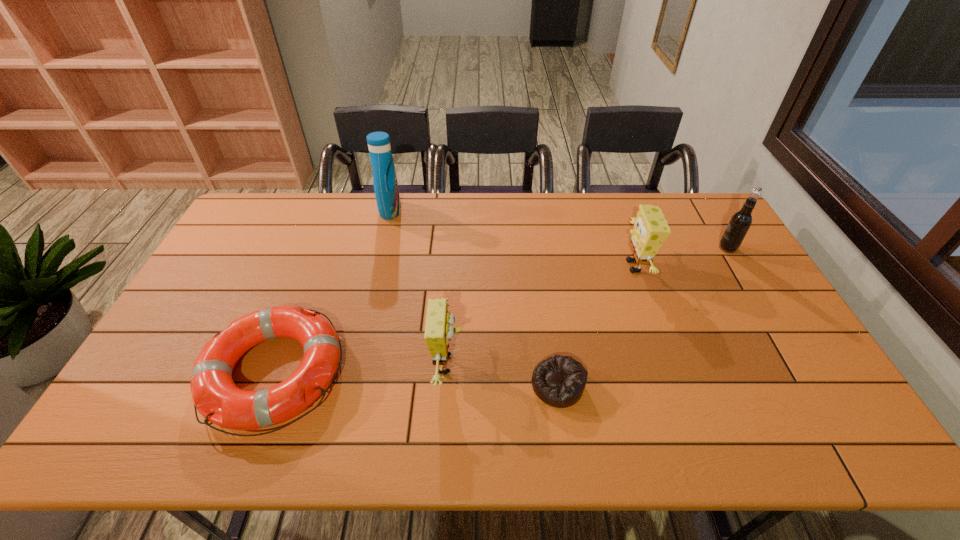
Where is `object at the far edge`? This screenshot has width=960, height=540. object at the far edge is located at coordinates (385, 183).

Where is `object that is at the near edge`? This screenshot has height=540, width=960. object that is at the near edge is located at coordinates (216, 397).

The height and width of the screenshot is (540, 960). In order to click on object located in the left edge section of the desktop in this screenshot , I will do `click(216, 397)`.

The image size is (960, 540). What are the coordinates of `object present at the right edge` in the screenshot? It's located at (741, 221).

I want to click on object located in the near left corner section of the desktop, so click(216, 397).

This screenshot has height=540, width=960. In the image, there is a desktop. Find the location of `free space at the far edge`. free space at the far edge is located at coordinates (427, 212).

Locate an element on the screen. vacant space at the near edge of the desktop is located at coordinates click(x=223, y=435).

Where is `free space at the left edge of the desktop`? free space at the left edge of the desktop is located at coordinates (215, 272).

The height and width of the screenshot is (540, 960). Find the location of `free location at the right edge`. free location at the right edge is located at coordinates (731, 290).

At what (x,y) coordinates should I click in order to perform the action: click on free space between the rightmost object and the farther sponge. Please return your answer as a coordinate pair (x, y). The image size is (960, 540). Looking at the image, I should click on (681, 257).